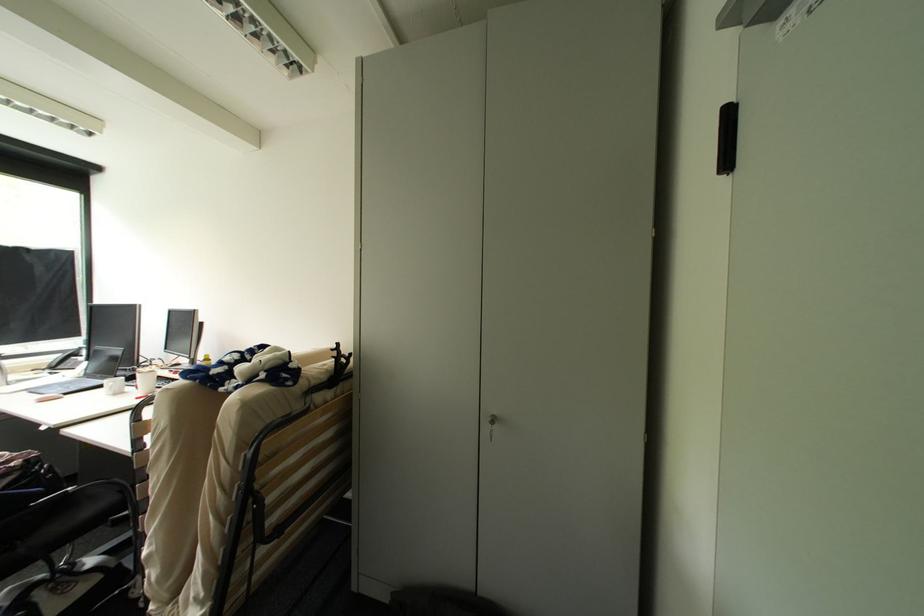
At what (x,y) coordinates should I click in order to perform the action: click on black frame handle. Please return your answer as a coordinate pair (x, y). The width and height of the screenshot is (924, 616). Looking at the image, I should click on (333, 376).